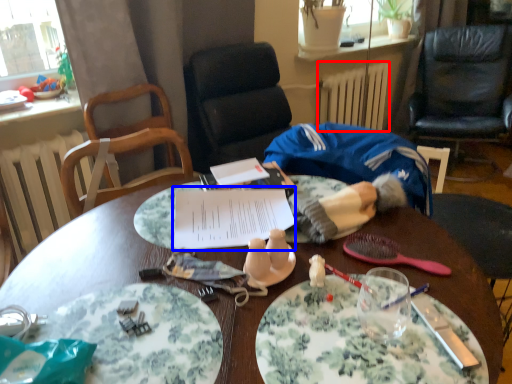
Question: Which object appears closest to the camera in this image, radiator (highlighted by a red box) or notebook (highlighted by a blue box)?

Choices:
 (A) radiator
 (B) notebook

Answer: (B)